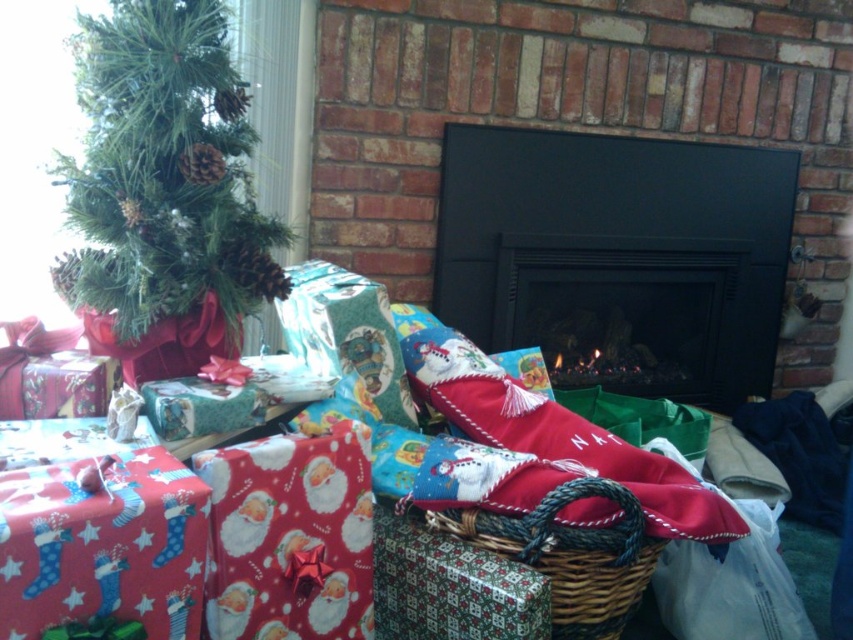
You are a delivery person who just arrived at the house and need to place a new gift. The gift is 24 inches wide. You see the green matte christmas tree at upper left and the patterned paper gift at center. Is there enough space between them to place the gift without moving anything?

The green matte christmas tree at upper left is 22.18 inches from the patterned paper gift at center. Since the new gift is 24 inches wide, there isn not enough space between them to place the gift without moving anything.

You are standing in front of the fireplace and want to place a new gift on the shelf above the fireplace. The shelf is located at point coordinates between 0.2 and 0.3 on the horizontal axis and between 0.1 and 0.2 on the vertical axis. Is the green matte christmas tree at upper left currently occupying that shelf space?

The green matte christmas tree at upper left is positioned at point coordinates 0.269 on the horizontal axis and 0.193 on the vertical axis, which falls within the specified shelf space coordinates between 0.2 and 0.3 horizontally and 0.1 and 0.2 vertically. Therefore, the shelf space is currently occupied by the green matte christmas tree at upper left.